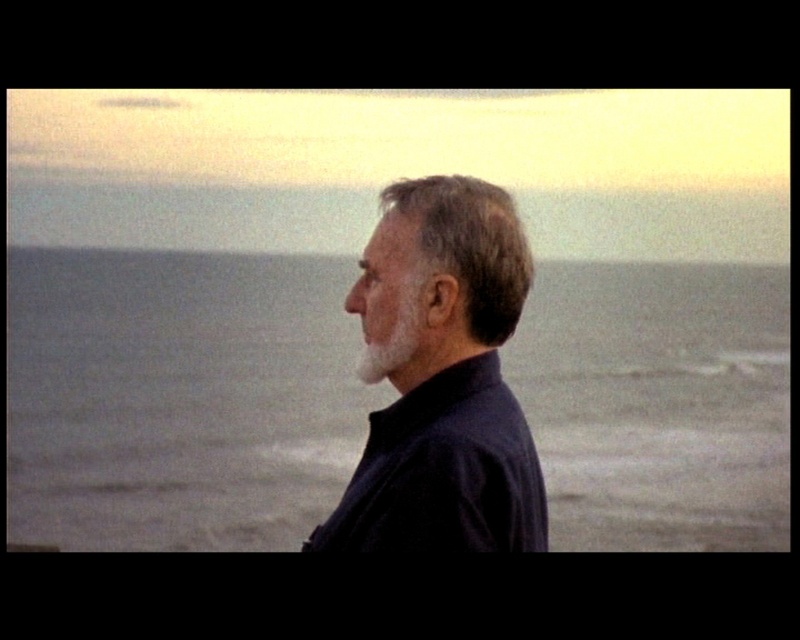
Is point (96, 500) farther from viewer compared to point (364, 496)?

Yes, it is.

Can you confirm if gray matte water at center is positioned to the right of dark blue shirt at center?

In fact, gray matte water at center is to the left of dark blue shirt at center.

Where is `gray matte water at center`? This screenshot has width=800, height=640. gray matte water at center is located at coordinates (178, 397).

Between gray matte water at center and dark brown textured hair at center, which one appears on the left side from the viewer's perspective?

Positioned to the left is gray matte water at center.

Measure the distance between point (572, 541) and camera.

The distance of point (572, 541) from camera is 38.06 meters.

Which is in front, point (12, 531) or point (450, 180)?

Positioned in front is point (450, 180).

Identify the location of gray matte water at center. The height and width of the screenshot is (640, 800). (178, 397).

Does dark blue shirt at center come in front of dark brown textured hair at center?

Yes.

Is dark blue shirt at center to the right of dark brown textured hair at center from the viewer's perspective?

No, dark blue shirt at center is not to the right of dark brown textured hair at center.

Is point (429, 276) positioned before point (476, 209)?

That is False.

What are the coordinates of `dark blue shirt at center` in the screenshot? It's located at (441, 380).